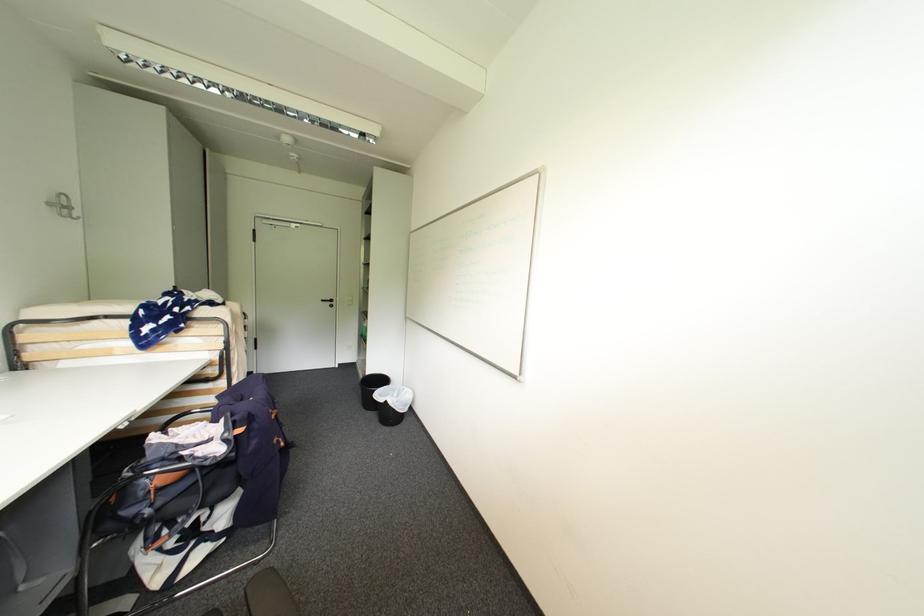
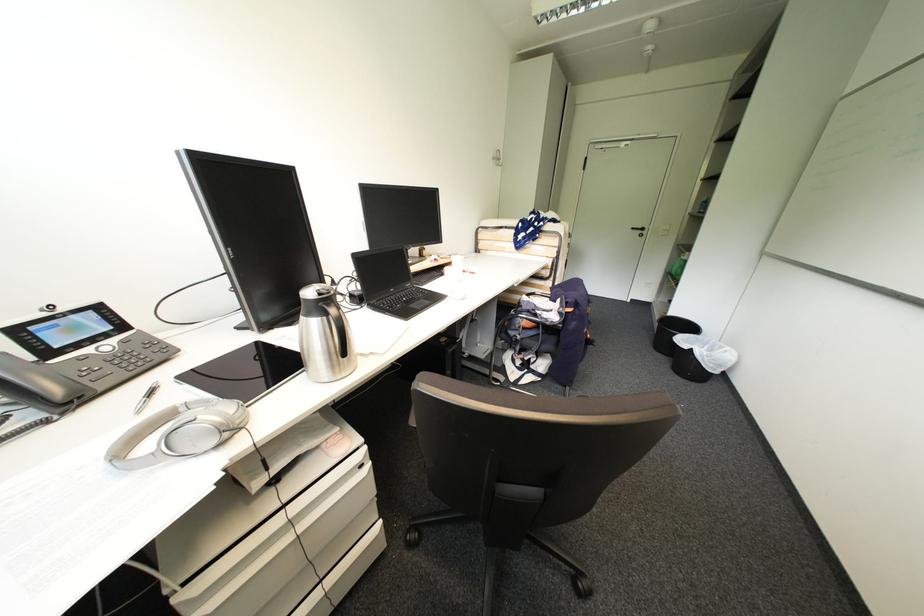
Locate, in the second image, the point that corresponds to pixel 383 411 in the first image.

(677, 359)